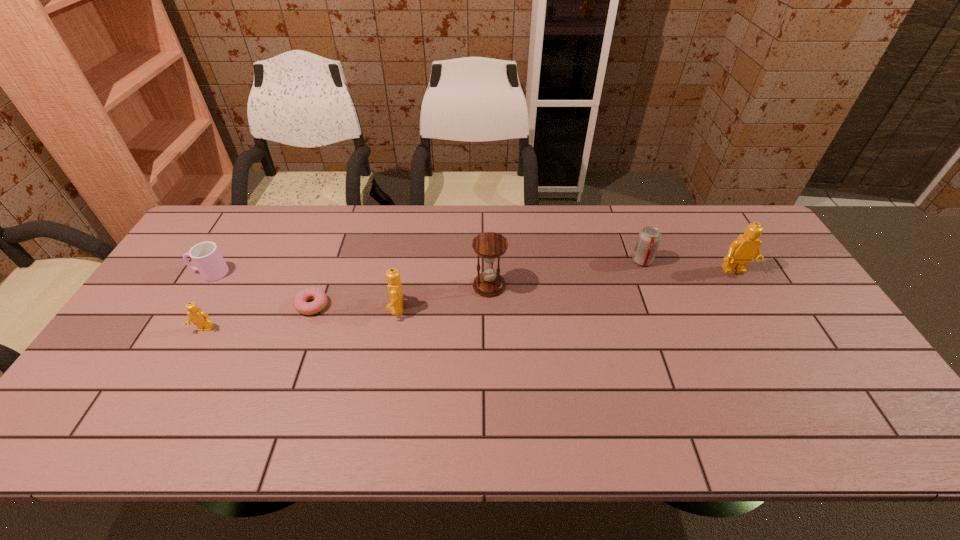
Where is `vacant area that lies between the rightmost object and the soda can`? The image size is (960, 540). vacant area that lies between the rightmost object and the soda can is located at coordinates (688, 266).

At what (x,y) coordinates should I click in order to perform the action: click on vacant space that is in between the cup and the fourth shortest object. Please return your answer as a coordinate pair (x, y). The width and height of the screenshot is (960, 540). Looking at the image, I should click on (426, 267).

The image size is (960, 540). I want to click on vacant area that lies between the rightmost Lego and the cup, so click(x=472, y=272).

Image resolution: width=960 pixels, height=540 pixels. I want to click on free space between the second object from right to left and the cup, so pyautogui.click(x=426, y=267).

The image size is (960, 540). What are the coordinates of `empty space between the cup and the rightmost object` in the screenshot? It's located at (472, 272).

Where is `object that is the third closest one to the shortest Lego`? object that is the third closest one to the shortest Lego is located at coordinates (395, 289).

The image size is (960, 540). In order to click on the second closest object to the third object from left to right in this screenshot , I will do `click(198, 317)`.

The width and height of the screenshot is (960, 540). Identify the location of the second closest Lego to the doughnut. (198, 317).

Select which Lego is the third closest to the cup. Please provide its 2D coordinates. Your answer should be formatted as a tuple, i.e. [(x, y)], where the tuple contains the x and y coordinates of a point satisfying the conditions above.

[(746, 247)]